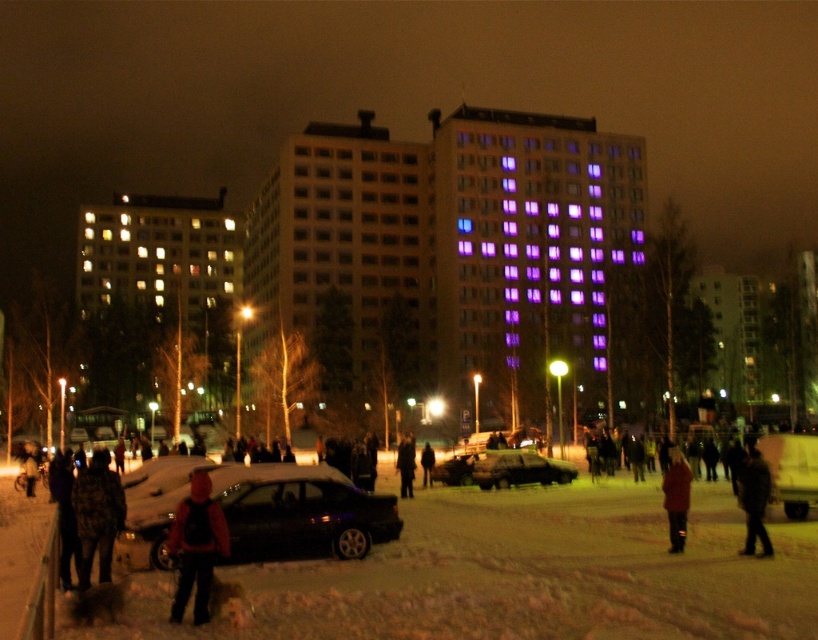
Does dark brown leather jacket at lower right have a lesser height compared to dark brown leather jacket at center?

No, dark brown leather jacket at lower right is not shorter than dark brown leather jacket at center.

What do you see at coordinates (754, 500) in the screenshot? I see `dark brown leather jacket at lower right` at bounding box center [754, 500].

Who is more forward, (766, 502) or (427, 451)?

Point (766, 502) is in front.

Where is `dark brown leather jacket at lower right`? The image size is (818, 640). dark brown leather jacket at lower right is located at coordinates (754, 500).

Does snow-covered car at lower left appear under camouflage jacket at lower left?

Yes.

Find the location of a particular element. Image resolution: width=818 pixels, height=640 pixels. snow-covered car at lower left is located at coordinates click(x=299, y=512).

Locate an element on the screen. This screenshot has width=818, height=640. snow-covered car at lower left is located at coordinates (299, 512).

Can you confirm if dark brown leather jacket at lower right is positioned to the left of red matte jacket at lower right?

Incorrect, dark brown leather jacket at lower right is not on the left side of red matte jacket at lower right.

Which of these two, dark brown leather jacket at lower right or red matte jacket at lower right, stands taller?

dark brown leather jacket at lower right is taller.

Is point (740, 461) farther from viewer compared to point (672, 548)?

Yes, point (740, 461) is farther from viewer.

Find the location of `dark brown leather jacket at lower right`. dark brown leather jacket at lower right is located at coordinates (754, 500).